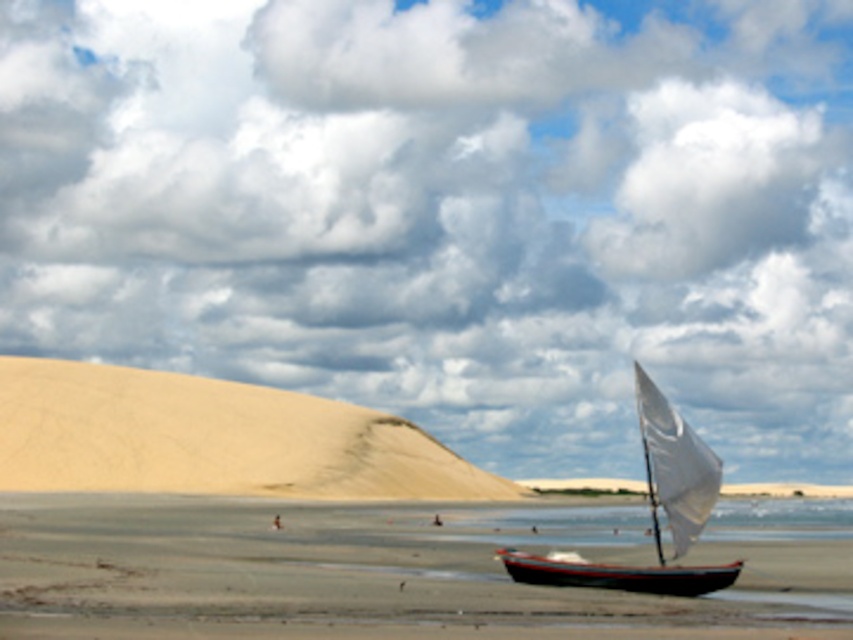
Question: Can you confirm if smooth sand dune at left is positioned to the left of wooden sailboat at lower right?

Choices:
 (A) yes
 (B) no

Answer: (A)

Question: Does white canvas sailboat at right appear on the left side of wooden sailboat at lower right?

Choices:
 (A) yes
 (B) no

Answer: (B)

Question: Which point is farther to the camera?

Choices:
 (A) (44, 131)
 (B) (245, 636)

Answer: (A)

Question: Which point is farther to the camera?

Choices:
 (A) smooth sand dune at left
 (B) wooden sailboat at lower right

Answer: (A)

Question: Which point is farther to the camera?

Choices:
 (A) smooth sand beach at lower center
 (B) white canvas sailboat at right

Answer: (B)

Question: Is white canvas sailboat at right positioned at the back of wooden sailboat at lower right?

Choices:
 (A) no
 (B) yes

Answer: (A)